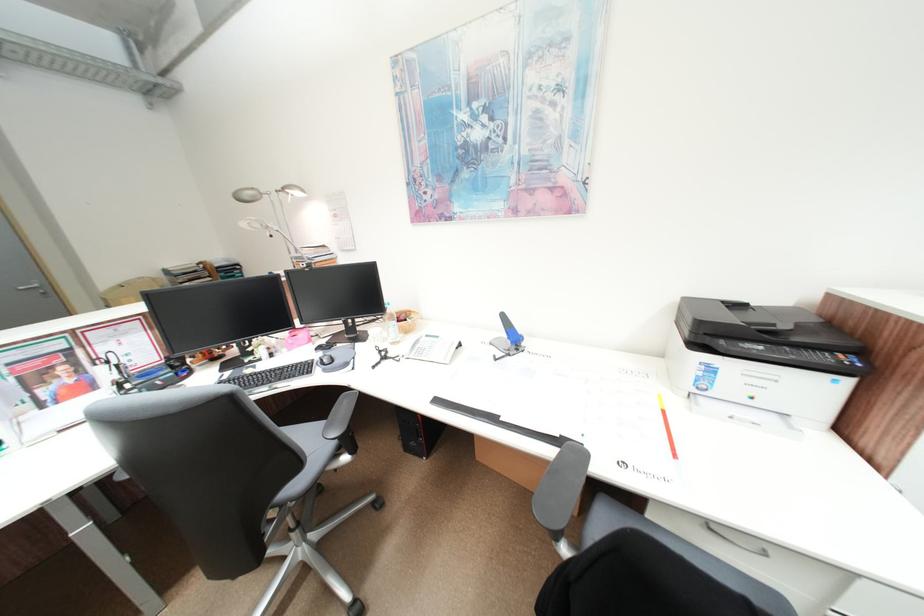
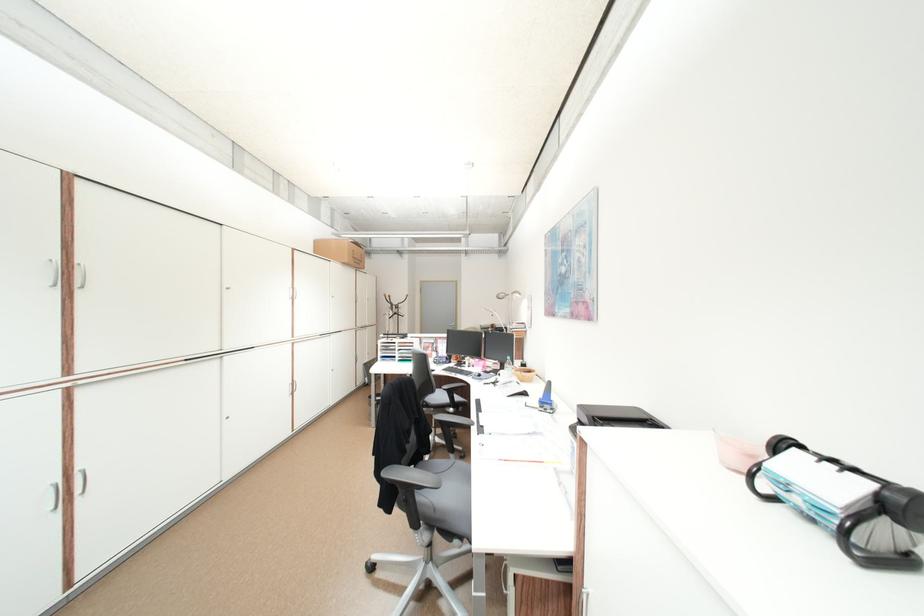
Find the pixel in the second image that matches (351,330) in the first image.

(507, 368)